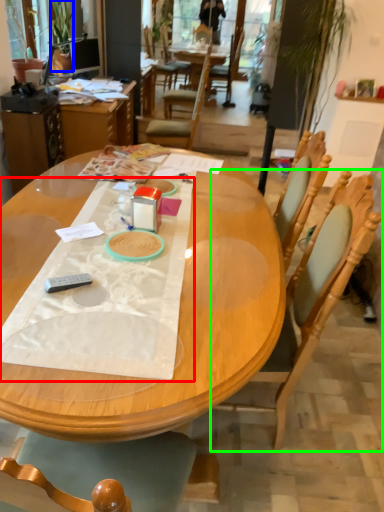
Question: Which object is positioned closest to sheet (highlighted by a red box)? Select from houseplant (highlighted by a blue box) and chair (highlighted by a green box).

Choices:
 (A) houseplant
 (B) chair

Answer: (B)